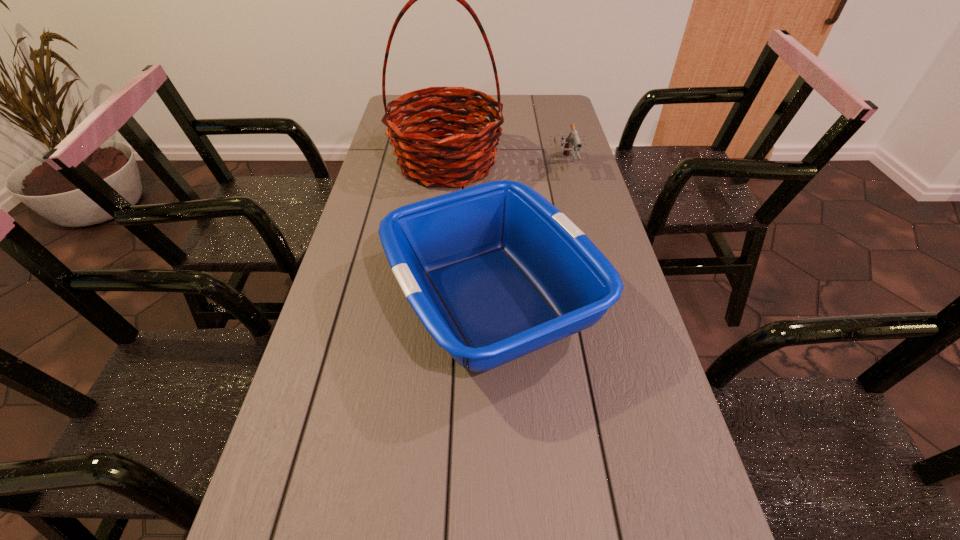
Identify the location of gun that is at the right edge. (573, 139).

At what (x,y) coordinates should I click in order to perform the action: click on vacant space at the left edge of the desktop. Please return your answer as a coordinate pair (x, y). Looking at the image, I should click on (393, 301).

I want to click on vacant area at the right edge, so click(x=613, y=255).

Find the location of a particular element. This screenshot has height=540, width=960. free region at the far right corner of the desktop is located at coordinates (549, 105).

Where is `free space between the shortest object and the tallest object`? The image size is (960, 540). free space between the shortest object and the tallest object is located at coordinates (506, 164).

What are the coordinates of `empty location between the gun and the basket` in the screenshot? It's located at (506, 164).

Where is `empty space that is in between the tallest object and the gun`? This screenshot has width=960, height=540. empty space that is in between the tallest object and the gun is located at coordinates (506, 164).

In order to click on vacant point located between the basket and the gun in this screenshot , I will do `click(506, 164)`.

Identify the location of vacant space that is in between the tallest object and the gun. (506, 164).

Where is `object that stands as the second closest to the tallest object`? The image size is (960, 540). object that stands as the second closest to the tallest object is located at coordinates (494, 272).